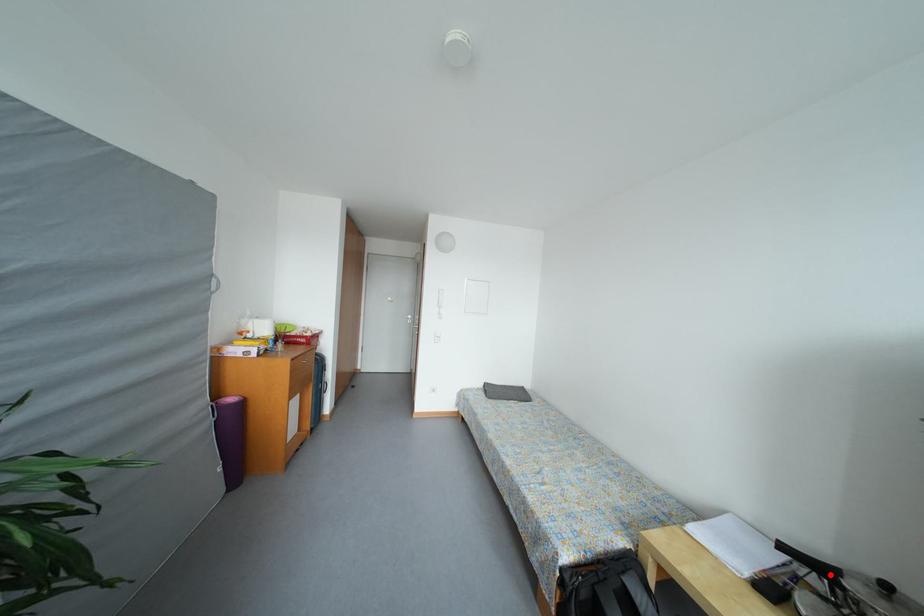
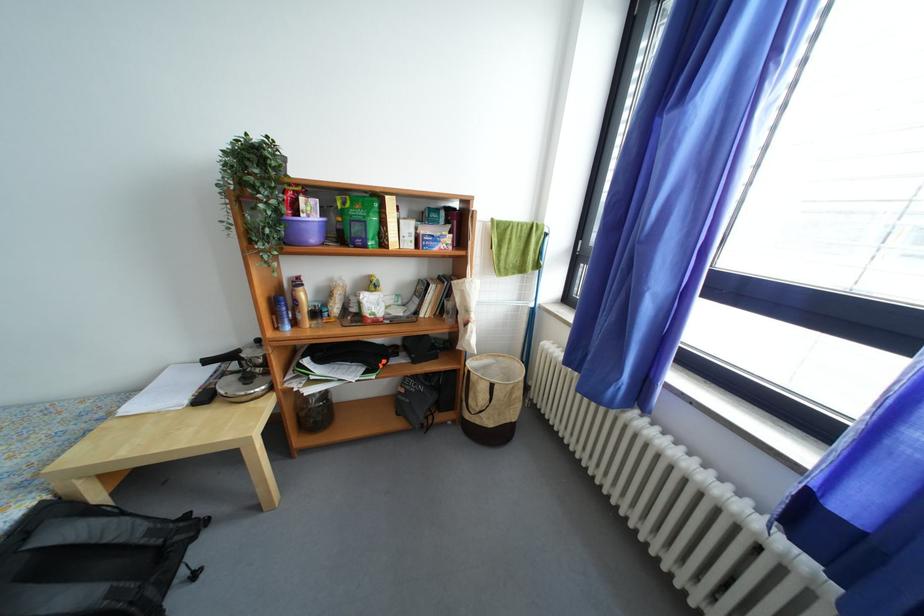
Locate, in the second image, the point that corresponds to the highlighted location in the first image.

(238, 361)